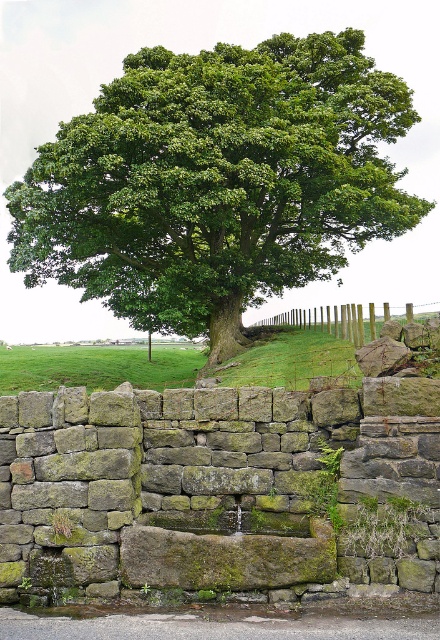
Is green mossy stone at center wider than wooden posts at center?

Incorrect, green mossy stone at center's width does not surpass wooden posts at center's.

Is point (213, 467) positioned before point (308, 316)?

Yes, point (213, 467) is in front of point (308, 316).

Where is `green mossy stone at center`? The height and width of the screenshot is (640, 440). green mossy stone at center is located at coordinates (219, 492).

Find the location of `green mossy stone at center`. green mossy stone at center is located at coordinates (219, 492).

Between green leafy tree at upper center and wooden posts at center, which one is positioned lower?

wooden posts at center

Does green leafy tree at upper center appear over wooden posts at center?

Yes.

Which is in front, point (223, 145) or point (352, 340)?

Point (223, 145)

Identify the location of green leafy tree at upper center. The image size is (440, 640). (216, 180).

Can you confirm if green mossy stone at center is positioned to the left of green leafy tree at upper center?

In fact, green mossy stone at center is to the right of green leafy tree at upper center.

Which of these two, green mossy stone at center or green leafy tree at upper center, stands taller?

With more height is green leafy tree at upper center.

Does point (121, 518) come farther from viewer compared to point (278, 268)?

No, (121, 518) is closer to viewer.

What are the coordinates of `green mossy stone at center` in the screenshot? It's located at [219, 492].